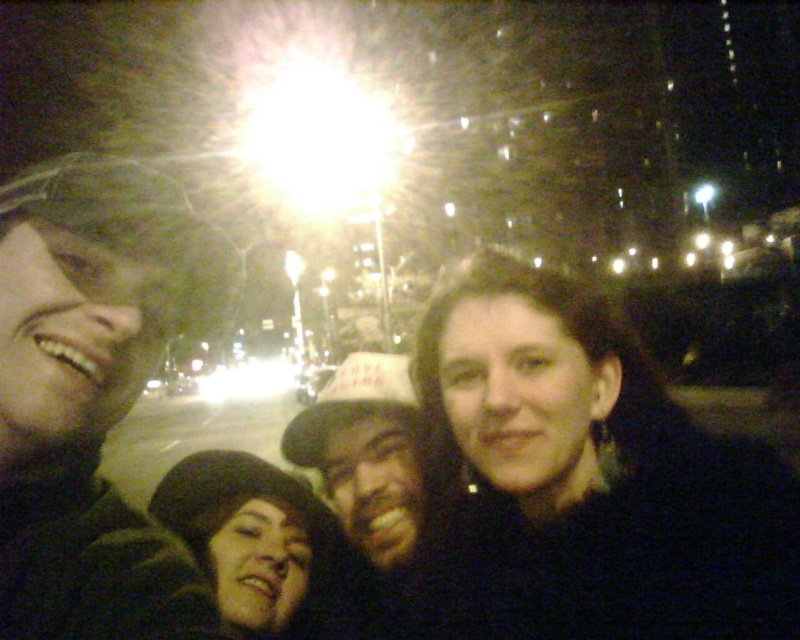
Question: Which point is closer to the camera?

Choices:
 (A) dark brown fur hat at lower left
 (B) dark brown hair at center

Answer: (B)

Question: Among these points, which one is farthest from the camera?

Choices:
 (A) (42, 547)
 (B) (277, 592)
 (C) (742, 444)

Answer: (B)

Question: Does dark brown hair at left appear under dark brown leather hat at center?

Choices:
 (A) no
 (B) yes

Answer: (A)

Question: Which object is the farthest from the dark brown leather hat at center?

Choices:
 (A) dark brown hair at left
 (B) dark brown fur hat at lower left

Answer: (A)

Question: Does dark brown hair at center have a larger size compared to dark brown leather hat at center?

Choices:
 (A) yes
 (B) no

Answer: (B)

Question: Does dark brown hair at center lie in front of dark brown hair at left?

Choices:
 (A) yes
 (B) no

Answer: (B)